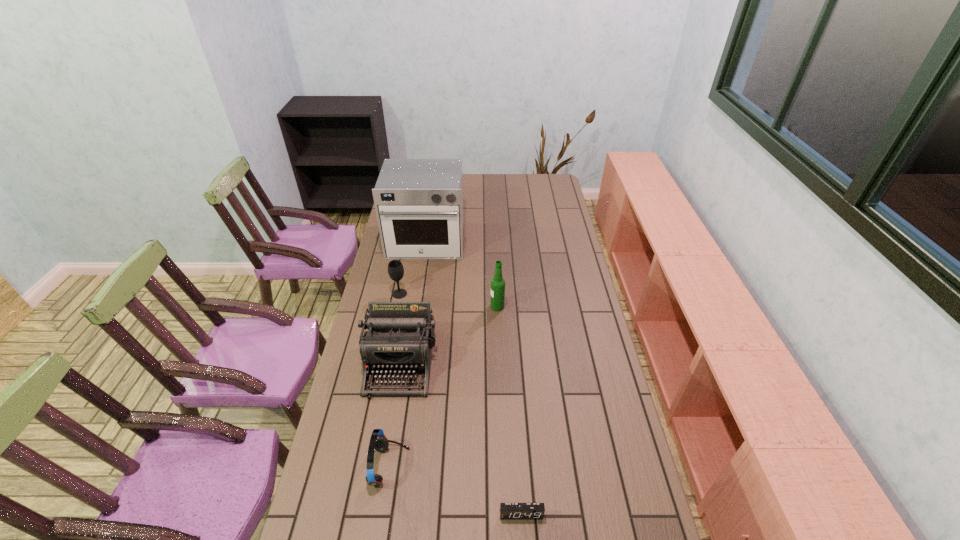
Find the location of a particular element. the farthest object is located at coordinates (419, 202).

At what (x,y) coordinates should I click in order to perform the action: click on the tallest object. Please return your answer as a coordinate pair (x, y). Looking at the image, I should click on (419, 202).

This screenshot has height=540, width=960. Find the location of `beer bottle`. beer bottle is located at coordinates (497, 283).

Locate an element on the screen. This screenshot has width=960, height=540. the fourth nearest object is located at coordinates (497, 283).

Where is `the third tallest object`? The height and width of the screenshot is (540, 960). the third tallest object is located at coordinates (400, 338).

I want to click on typewriter, so click(x=400, y=338).

You are a GUI agent. You are given a task and a screenshot of the screen. Output one action in this format:
    pyautogui.click(x=<x>, y=<y>)
    Task: Click on the fourth tallest object
    This screenshot has height=540, width=960.
    Given the screenshot: What is the action you would take?
    pyautogui.click(x=395, y=268)

This screenshot has height=540, width=960. Identify the location of the second farthest object. (395, 268).

You are a GUI agent. You are given a task and a screenshot of the screen. Output one action in this format:
    pyautogui.click(x=<x>, y=<y>)
    Task: Click on the second shortest object
    The height and width of the screenshot is (540, 960).
    Given the screenshot: What is the action you would take?
    pyautogui.click(x=378, y=441)

Find the location of a particular element. headset is located at coordinates (378, 441).